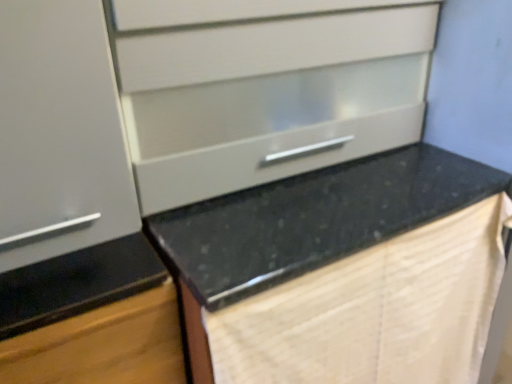
Question: Can you confirm if beige textured blanket at lower right is taller than black granite countertop at center?

Choices:
 (A) yes
 (B) no

Answer: (B)

Question: From a real-world perspective, is beige textured blanket at lower right below black granite countertop at center?

Choices:
 (A) no
 (B) yes

Answer: (A)

Question: Can you confirm if beige textured blanket at lower right is thinner than black granite countertop at center?

Choices:
 (A) no
 (B) yes

Answer: (B)

Question: Is beige textured blanket at lower right bigger than black granite countertop at center?

Choices:
 (A) no
 (B) yes

Answer: (A)

Question: From the image's perspective, does beige textured blanket at lower right appear higher than black granite countertop at center?

Choices:
 (A) yes
 (B) no

Answer: (B)

Question: Is beige textured blanket at lower right located outside black granite countertop at center?

Choices:
 (A) no
 (B) yes

Answer: (A)

Question: Is matte white drawer at upper center smaller than black granite countertop at center?

Choices:
 (A) no
 (B) yes

Answer: (B)

Question: Is matte white drawer at upper center taller than black granite countertop at center?

Choices:
 (A) no
 (B) yes

Answer: (A)

Question: Is matte white drawer at upper center shorter than black granite countertop at center?

Choices:
 (A) yes
 (B) no

Answer: (A)

Question: From a real-world perspective, is matte white drawer at upper center physically below black granite countertop at center?

Choices:
 (A) yes
 (B) no

Answer: (B)

Question: Considering the relative positions of matte white drawer at upper center and black granite countertop at center in the image provided, is matte white drawer at upper center to the left of black granite countertop at center from the viewer's perspective?

Choices:
 (A) yes
 (B) no

Answer: (A)

Question: Considering the relative sizes of matte white drawer at upper center and black granite countertop at center in the image provided, is matte white drawer at upper center thinner than black granite countertop at center?

Choices:
 (A) yes
 (B) no

Answer: (A)

Question: Considering the relative positions of beige textured blanket at lower right and matte white drawer at upper center in the image provided, is beige textured blanket at lower right in front of matte white drawer at upper center?

Choices:
 (A) no
 (B) yes

Answer: (B)